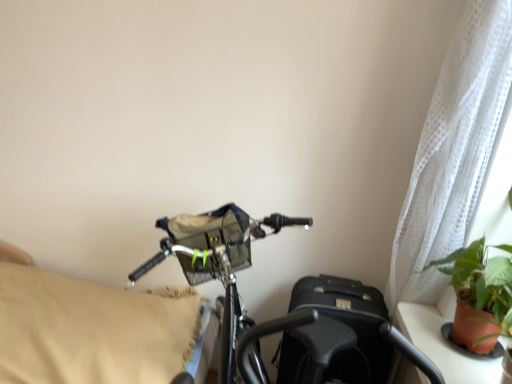
Question: Does white sheer curtain at upper right have a lesser height compared to shiny metallic bicycle at center?

Choices:
 (A) yes
 (B) no

Answer: (B)

Question: Is white sheer curtain at upper right next to shiny metallic bicycle at center and touching it?

Choices:
 (A) no
 (B) yes

Answer: (A)

Question: Can you confirm if white sheer curtain at upper right is taller than shiny metallic bicycle at center?

Choices:
 (A) yes
 (B) no

Answer: (A)

Question: Does white sheer curtain at upper right appear on the right side of shiny metallic bicycle at center?

Choices:
 (A) yes
 (B) no

Answer: (A)

Question: From a real-world perspective, is white sheer curtain at upper right physically below shiny metallic bicycle at center?

Choices:
 (A) yes
 (B) no

Answer: (B)

Question: Is white sheer curtain at upper right aimed at shiny metallic bicycle at center?

Choices:
 (A) no
 (B) yes

Answer: (A)

Question: Is beige fabric pillow at left further to camera compared to shiny metallic bicycle at center?

Choices:
 (A) yes
 (B) no

Answer: (A)

Question: Is shiny metallic bicycle at center surrounded by beige fabric pillow at left?

Choices:
 (A) yes
 (B) no

Answer: (B)

Question: Is beige fabric pillow at left positioned beyond the bounds of shiny metallic bicycle at center?

Choices:
 (A) yes
 (B) no

Answer: (A)

Question: Is beige fabric pillow at left thinner than shiny metallic bicycle at center?

Choices:
 (A) no
 (B) yes

Answer: (A)

Question: Is beige fabric pillow at left positioned in front of shiny metallic bicycle at center?

Choices:
 (A) no
 (B) yes

Answer: (A)

Question: Would you say beige fabric pillow at left is a long distance from shiny metallic bicycle at center?

Choices:
 (A) yes
 (B) no

Answer: (B)

Question: Is white sheer curtain at upper right facing away from beige fabric pillow at left?

Choices:
 (A) no
 (B) yes

Answer: (A)